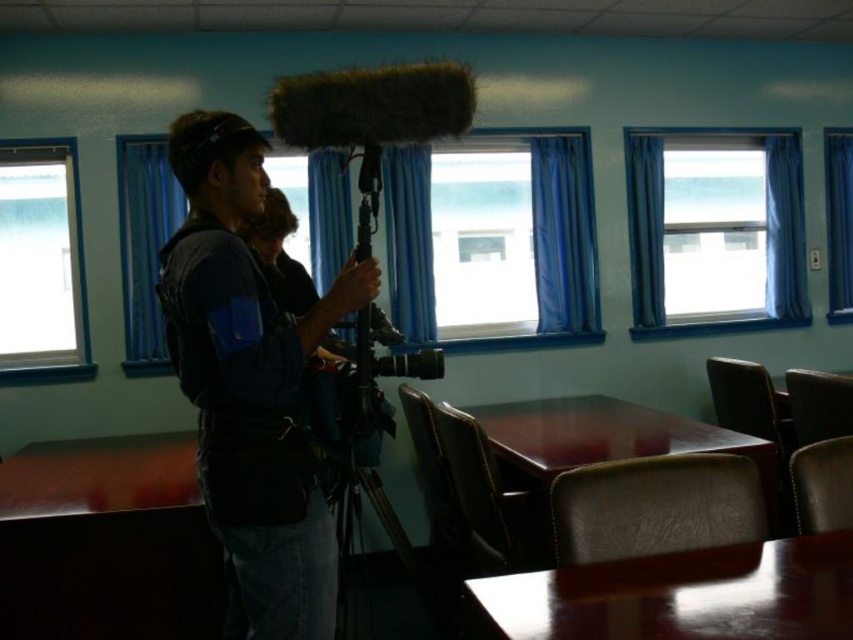
You are standing in the room and need to adjust the blue curtain at upper right. Based on its position, which direction should you move to reach it?

The blue curtain at upper right is located at point (764, 234), so you should move towards the upper right direction to reach it.

You are a guest in this room and want to adjust the blue curtain at upper right and the blue fabric window at center to let in more light. Which one should you open first to maximize the light entering the room?

The blue curtain at upper right is wider than the blue fabric window at center, so opening it first would allow more light to enter the room.

You are standing in the room and see two points marked on the wall. The first point is at coordinates point (175, 182) and the second point is at point (845, 296). Which point is closer to you?

Point (175, 182) is in front of point (845, 296), so it is closer to you.